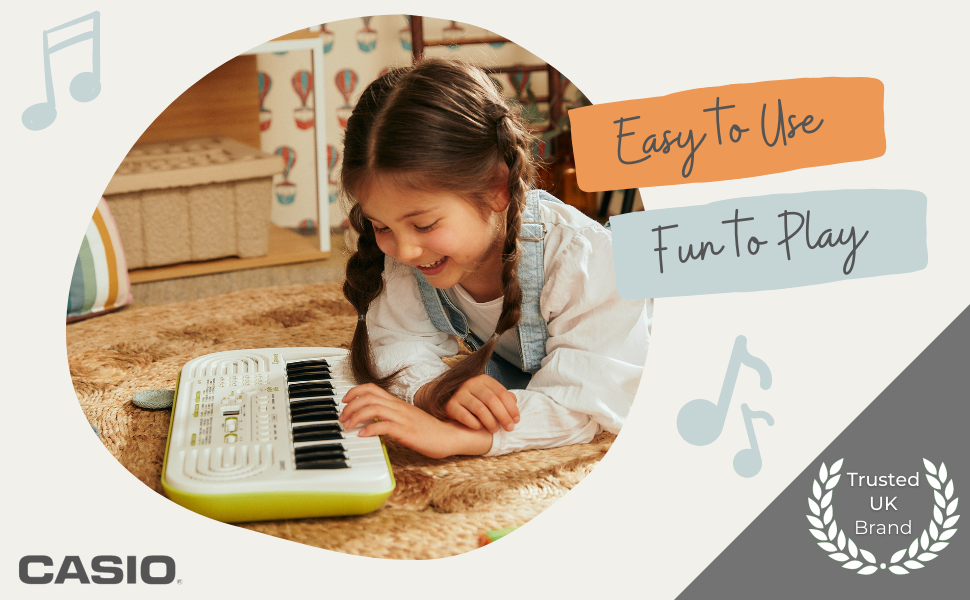
The height and width of the screenshot is (600, 970). In order to click on keyboard in this screenshot , I will do `click(279, 418)`.